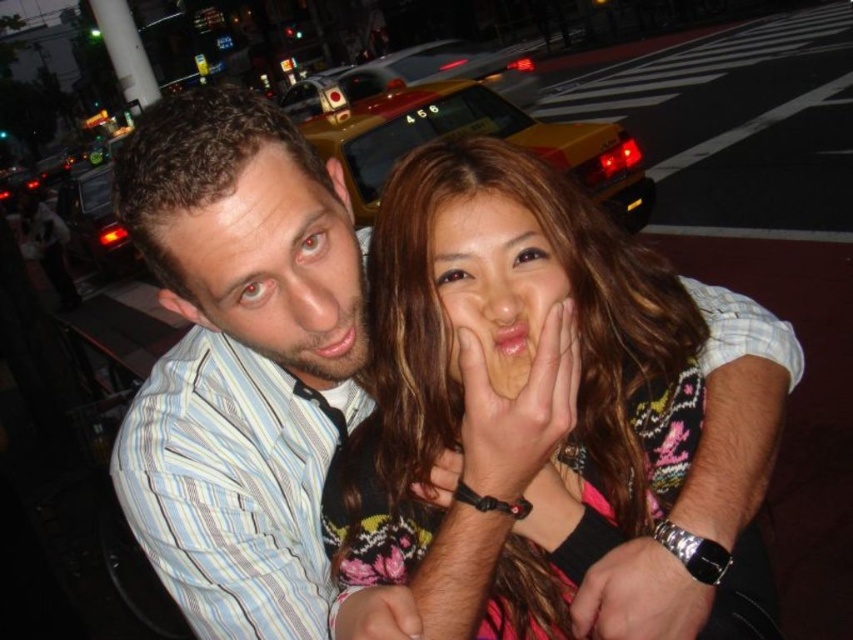
Is striped shirt at center closer to camera compared to yellow plastic taxi at upper center?

Yes.

Does striped shirt at center appear over yellow plastic taxi at upper center?

Actually, striped shirt at center is below yellow plastic taxi at upper center.

Does point (262, 113) lie in front of point (579, 152)?

That is True.

At what (x,y) coordinates should I click in order to perform the action: click on striped shirt at center. Please return your answer as a coordinate pair (x, y). This screenshot has width=853, height=640. Looking at the image, I should click on (239, 360).

Can you confirm if multicolored floral dress at center is positioned above yellow plastic taxi at upper center?

Actually, multicolored floral dress at center is below yellow plastic taxi at upper center.

Is point (697, 552) positioned after point (451, 109)?

No, (697, 552) is closer to viewer.

Where is `multicolored floral dress at center`? Image resolution: width=853 pixels, height=640 pixels. multicolored floral dress at center is located at coordinates (523, 385).

Is matte striped shirt at center closer to the viewer compared to yellow plastic taxi at upper center?

That is True.

Does matte striped shirt at center have a smaller size compared to yellow plastic taxi at upper center?

Yes.

This screenshot has width=853, height=640. Identify the location of matte striped shirt at center. (274, 266).

Find the location of a particular element. This screenshot has width=853, height=640. matte striped shirt at center is located at coordinates (274, 266).